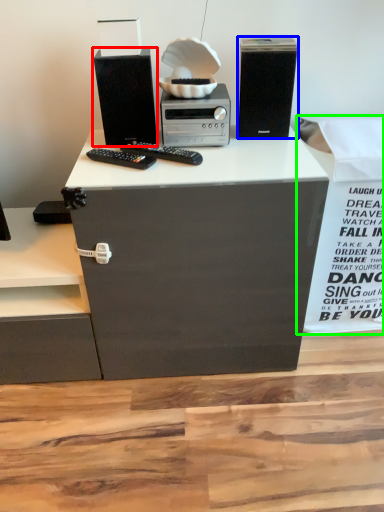
Question: Considering the real-world distances, which object is farthest from computer tower (highlighted by a red box)? computer tower (highlighted by a blue box) or cardboard box (highlighted by a green box)?

Choices:
 (A) computer tower
 (B) cardboard box

Answer: (B)